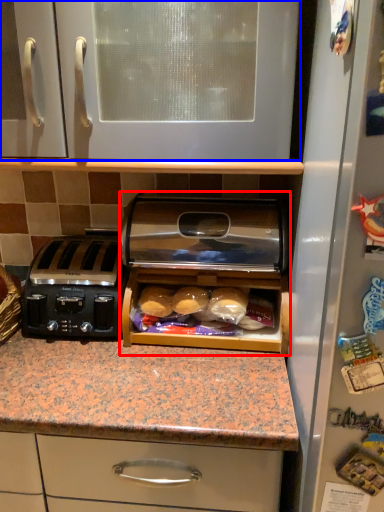
Question: Which object appears farthest to the camera in this image, home appliance (highlighted by a red box) or cabinetry (highlighted by a blue box)?

Choices:
 (A) home appliance
 (B) cabinetry

Answer: (A)